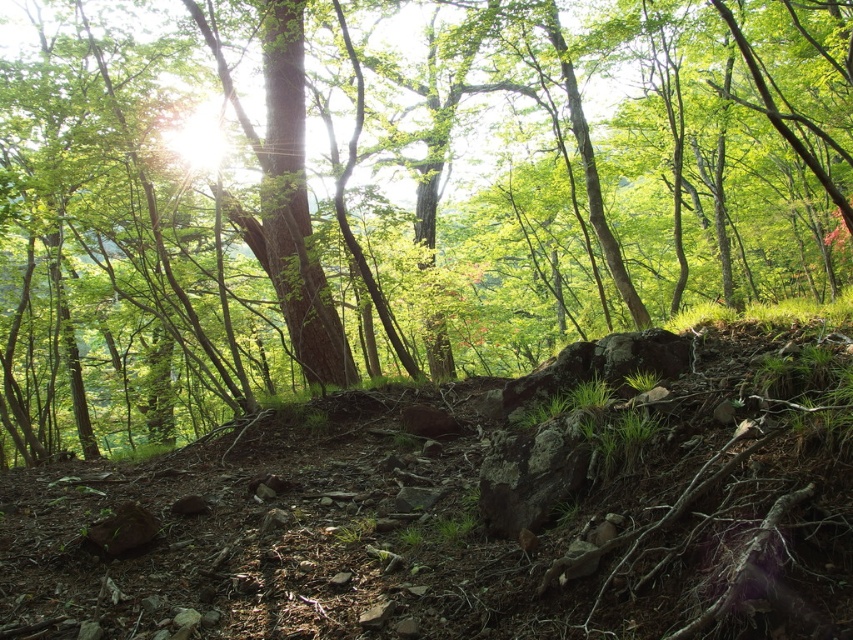
You are standing in the forest and want to take a photo of the green matte tree at center. If your camera has a maximum focus range of 4 meters, will you need to move closer to the tree to take a clear photo?

The green matte tree at center is 4.17 meters away from you, which exceeds the camera maximum focus range of 4 meters. Therefore, you need to move closer to the tree to take a clear photo.

You are a hiker who wants to take a photo of the green matte tree at center and the dull brown dirt at center. Since you want the tree to be the main focus, which object should you position closer to the camera?

You should position the green matte tree at center closer to the camera because it is much taller than the dull brown dirt at center, making it the main focus.